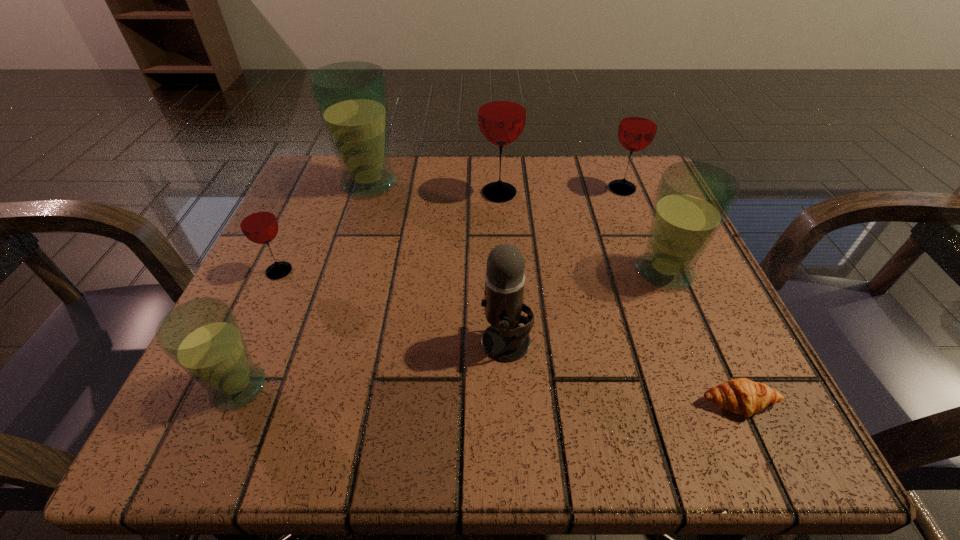
In the image, there is a desktop. Where is `vacant space at the far left corner`? vacant space at the far left corner is located at coordinates (312, 218).

At what (x,y) coordinates should I click in order to perform the action: click on free region at the near left corner. Please return your answer as a coordinate pair (x, y). This screenshot has width=960, height=540. Looking at the image, I should click on (231, 424).

Locate an element on the screen. The image size is (960, 540). free space at the far right corner is located at coordinates (614, 217).

In the image, there is a desktop. At what (x,y) coordinates should I click in order to perform the action: click on free space at the near right corner. Please return your answer as a coordinate pair (x, y). The width and height of the screenshot is (960, 540). Looking at the image, I should click on (659, 390).

Locate an element on the screen. The height and width of the screenshot is (540, 960). empty space between the farthest blue glass and the leftmost red glass is located at coordinates (324, 227).

Locate an element on the screen. This screenshot has height=540, width=960. vacant region between the microphone and the shortest object is located at coordinates (622, 373).

Locate an element on the screen. The image size is (960, 540). vacant space that is in between the biggest red glass and the leftmost red glass is located at coordinates (390, 232).

Where is `free area in between the gray microphone and the second farthest blue glass`? free area in between the gray microphone and the second farthest blue glass is located at coordinates (586, 307).

At what (x,y) coordinates should I click in order to perform the action: click on vacant area that lies between the nearest blue glass and the second smallest red glass. Please return your answer as a coordinate pair (x, y). This screenshot has height=540, width=960. Looking at the image, I should click on (430, 288).

Locate an element on the screen. empty location between the nearest blue glass and the pastry is located at coordinates (489, 395).